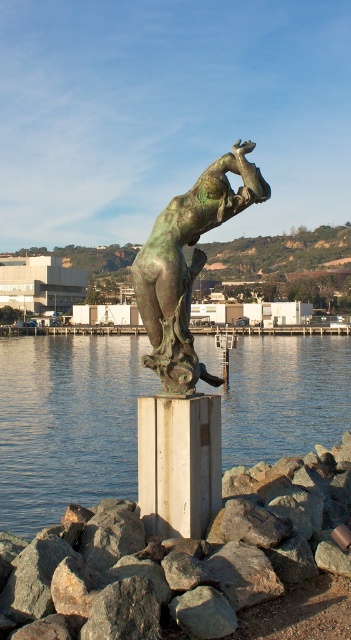
You are standing in front of the bronze sculpture near the water. There are two points marked on the sculpture. Which point is closer to you, point (294, 545) or point (248, 195)?

Point (294, 545) is closer to the viewer than point (248, 195).

You are standing at the base of the bronze sculpture and want to place a small flower bouquet at the point marked by coordinates point (180, 557). Based on the scene description, where exactly should you place the bouquet?

The point (180, 557) is on the gray rock at lower center, so you should place the bouquet on the gray rock at lower center near the lower central area of the scene.

Looking at this image, you are standing at the base of the bronze sculpture. You want to place a small flower bouquet at the exact location marked by the coordinates point (180,557). What object is already at that spot?

The gray rock at lower center is located at point (180,557).